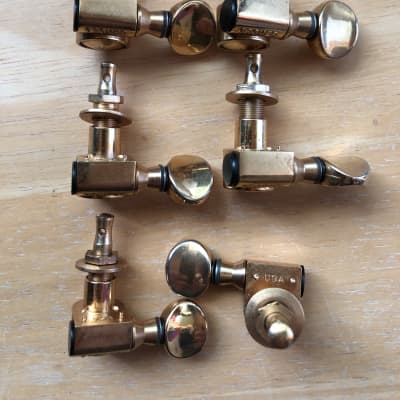
The image size is (400, 400). What are the coordinates of `rod` in the screenshot? It's located at (91, 250), (100, 74), (250, 67).